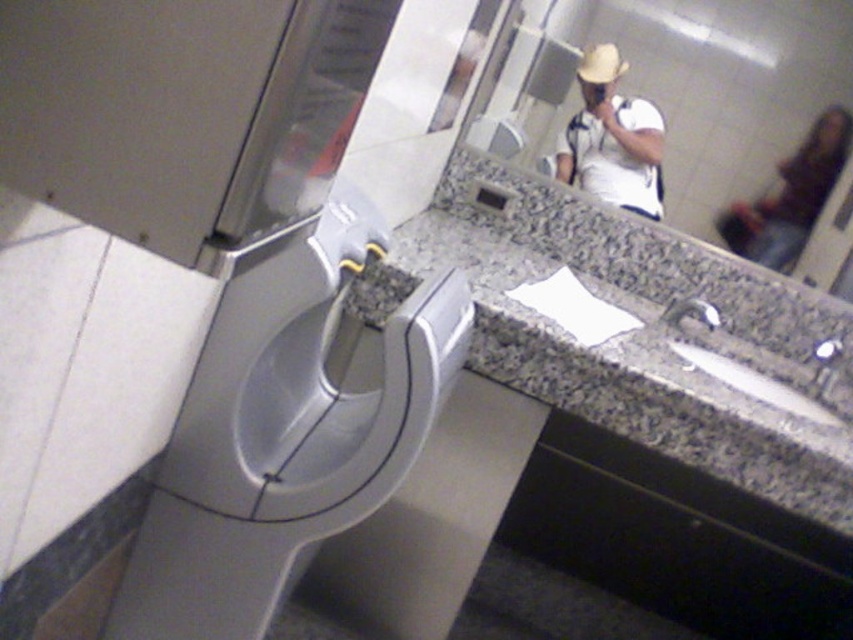
You are designing a layout for a restroom and need to ensure that the satin silver urinal at lower left and the reflective glass mirror at upper center are spaced appropriately. Given their sizes, which object should be placed closer to the entrance for better accessibility?

The satin silver urinal at lower left is larger in size than the reflective glass mirror at upper center, so it should be placed closer to the entrance to ensure there is enough space for users to access it comfortably.

You are standing in a restroom and need to reach both the satin silver urinal at lower left and the reflective glass mirror at upper center. Which object is taller?

The satin silver urinal at lower left is much taller than the reflective glass mirror at upper center.

You are standing in a restroom and want to place a small item on the nearest surface. Which object between the granite countertop at center and the white matte shirt at upper center can you place it on?

The granite countertop at center is closer to the viewer than the white matte shirt at upper center, so you can place the item on the granite countertop at center.